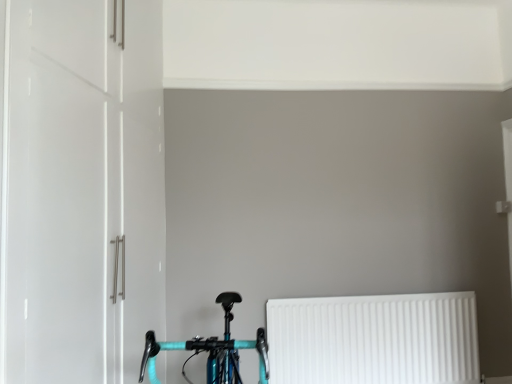
Question: From the image's perspective, is white plastic radiator at lower right above or below white glossy cabinet at left?

Choices:
 (A) above
 (B) below

Answer: (B)

Question: Considering the positions of white plastic radiator at lower right and white glossy cabinet at left in the image, is white plastic radiator at lower right taller or shorter than white glossy cabinet at left?

Choices:
 (A) tall
 (B) short

Answer: (B)

Question: Estimate the real-world distances between objects in this image. Which object is closer to the white glossy cabinet at left?

Choices:
 (A) teal glossy bicycle at lower center
 (B) white plastic radiator at lower right

Answer: (A)

Question: Which is farther from the teal glossy bicycle at lower center?

Choices:
 (A) white plastic radiator at lower right
 (B) white glossy cabinet at left

Answer: (A)